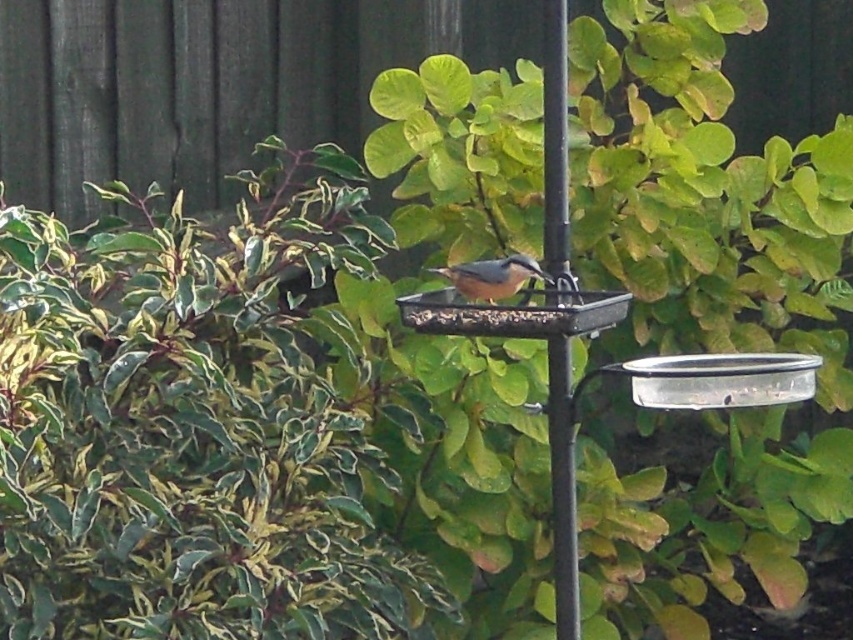
Based on the photo, you are a gardener trying to install a new bird feeder. You have a choice between placing it on the black metal pole at center or attaching it to the green leafy bush at center. Based on their height, which option would allow the bird feeder to be placed higher up?

The green leafy bush at center has a greater height compared to the black metal pole at center, so placing the bird feeder on the green leafy bush at center would allow it to be placed higher up.

You are a birdwatcher trying to observe the bird feeder. Which object, the green leafy bush at center or the black metal pole at center, would block your view of the feeder if you stand behind it?

The green leafy bush at center has a larger size compared to the black metal pole at center, so it would block your view more effectively if you stand behind it.

You are a birdwatcher trying to take a clear photo of the brown matte bird at center and the green leafy bush at center. Which object is blocking your view of the other?

The brown matte bird at center is behind the green leafy bush at center, so the green leafy bush at center is blocking the view of the brown matte bird at center.